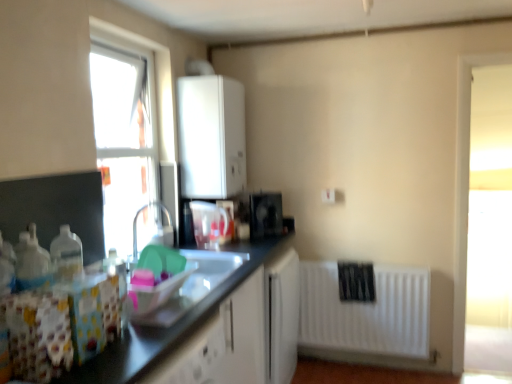
Question: From the image's perspective, is white matte boiler at upper center on top of translucent plastic container at center, which appears as the 2th appliance when viewed from the right?

Choices:
 (A) no
 (B) yes

Answer: (B)

Question: Considering the relative sizes of white matte boiler at upper center and translucent plastic container at center, which appears as the 2th appliance when viewed from the right, in the image provided, is white matte boiler at upper center bigger than translucent plastic container at center, which appears as the 2th appliance when viewed from the right,?

Choices:
 (A) no
 (B) yes

Answer: (B)

Question: Is there a large distance between white matte boiler at upper center and translucent plastic container at center, which is counted as the 2th appliance, starting from the back?

Choices:
 (A) no
 (B) yes

Answer: (A)

Question: Is white matte boiler at upper center oriented towards translucent plastic container at center, which is counted as the 2th appliance, starting from the back?

Choices:
 (A) no
 (B) yes

Answer: (A)

Question: Is white matte boiler at upper center to the left of translucent plastic container at center, which ranks as the 1th appliance in left-to-right order, from the viewer's perspective?

Choices:
 (A) no
 (B) yes

Answer: (A)

Question: Does white matte boiler at upper center appear on the right side of translucent plastic container at center, the first appliance when ordered from front to back?

Choices:
 (A) yes
 (B) no

Answer: (A)

Question: Does black plastic toaster at upper center, the 2th appliance viewed from the left, have a lesser height compared to shiny plastic containers at lower left?

Choices:
 (A) no
 (B) yes

Answer: (B)

Question: Can you confirm if black plastic toaster at upper center, which is the first appliance from back to front, is thinner than shiny plastic containers at lower left?

Choices:
 (A) yes
 (B) no

Answer: (A)

Question: Is shiny plastic containers at lower left at the back of black plastic toaster at upper center, the 1th appliance from the right?

Choices:
 (A) yes
 (B) no

Answer: (B)

Question: Could you tell me if black plastic toaster at upper center, the 2th appliance viewed from the left, is facing shiny plastic containers at lower left?

Choices:
 (A) yes
 (B) no

Answer: (B)

Question: Does black plastic toaster at upper center, the 1th appliance from the right, have a greater width compared to shiny plastic containers at lower left?

Choices:
 (A) yes
 (B) no

Answer: (B)

Question: Is black plastic toaster at upper center, which is the first appliance from back to front, at the left side of shiny plastic containers at lower left?

Choices:
 (A) yes
 (B) no

Answer: (B)

Question: Is white matte boiler at upper center looking in the opposite direction of white matte radiator at lower right?

Choices:
 (A) yes
 (B) no

Answer: (B)